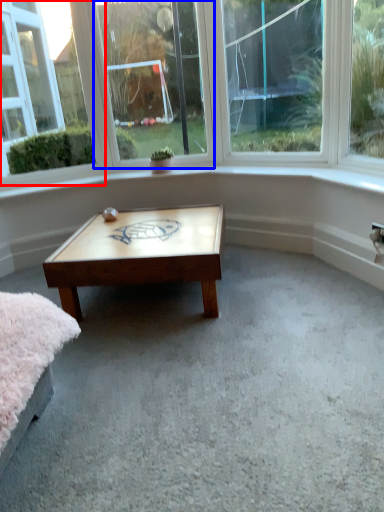
Question: Which of the following is the closest to the observer, window (highlighted by a red box) or window (highlighted by a blue box)?

Choices:
 (A) window
 (B) window

Answer: (A)